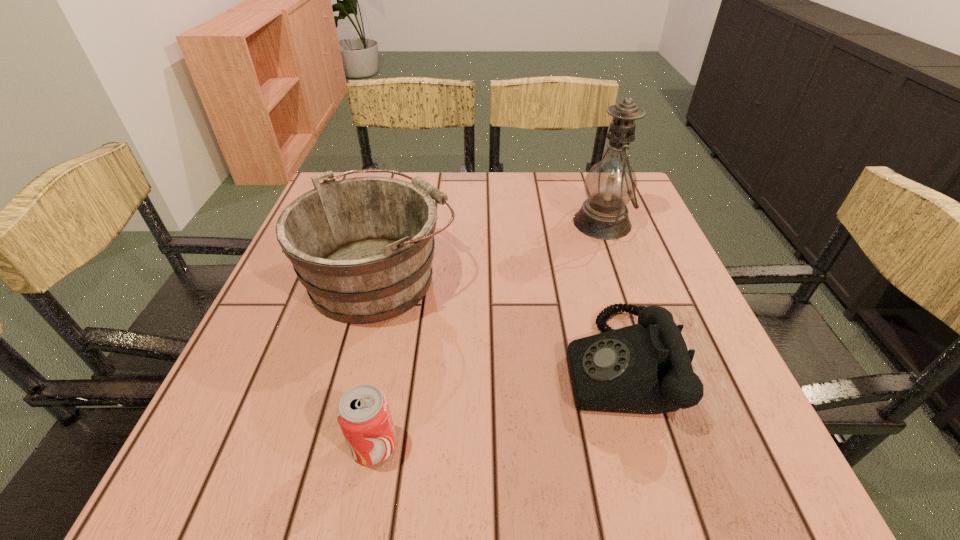
In order to click on object that is at the far edge in this screenshot , I will do `click(610, 184)`.

Where is `object at the near edge`? This screenshot has width=960, height=540. object at the near edge is located at coordinates (363, 413).

You are a GUI agent. You are given a task and a screenshot of the screen. Output one action in this format:
    pyautogui.click(x=<x>, y=<y>)
    Task: Click on the object that is at the left edge
    The height and width of the screenshot is (540, 960).
    Given the screenshot: What is the action you would take?
    pyautogui.click(x=362, y=247)

Where is `oil lamp located at the right edge`? oil lamp located at the right edge is located at coordinates (610, 184).

Find the location of a particular element. The width and height of the screenshot is (960, 540). telephone positioned at the right edge is located at coordinates (646, 368).

Where is `object located in the far right corner section of the desktop`? This screenshot has width=960, height=540. object located in the far right corner section of the desktop is located at coordinates 610,184.

Identify the location of vacant space at the far edge of the desktop. The width and height of the screenshot is (960, 540). (558, 193).

Find the location of a particular element. vacant space at the near edge is located at coordinates (291, 491).

The width and height of the screenshot is (960, 540). I want to click on vacant space at the right edge, so (715, 427).

In the image, there is a desktop. Identify the location of vacant space at the near right corner. Image resolution: width=960 pixels, height=540 pixels. (745, 461).